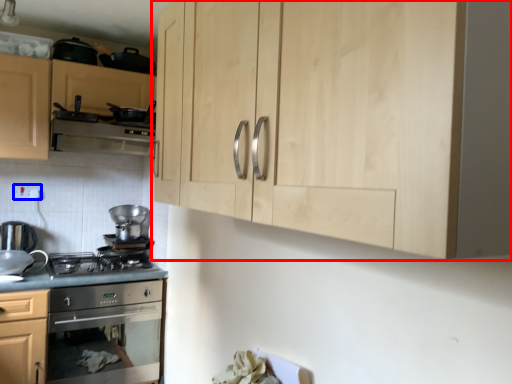
Question: Which point is closer to the camera, cabinetry (highlighted by a red box) or electric outlet (highlighted by a blue box)?

Choices:
 (A) cabinetry
 (B) electric outlet

Answer: (A)